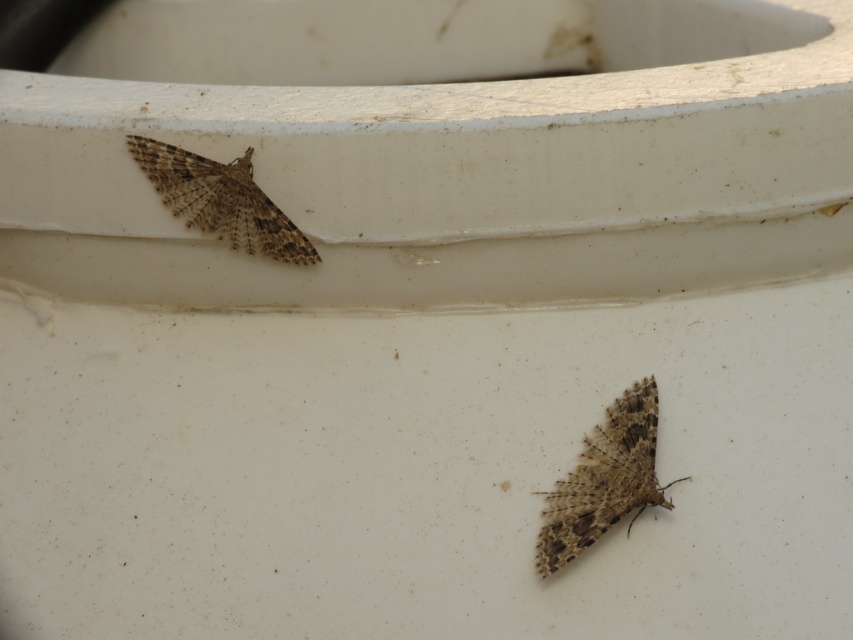
Is brown textured moth at lower center closer to camera compared to brown textured moth at upper left?

Yes, it is in front of brown textured moth at upper left.

This screenshot has width=853, height=640. Describe the element at coordinates (604, 480) in the screenshot. I see `brown textured moth at lower center` at that location.

At what (x,y) coordinates should I click in order to perform the action: click on brown textured moth at lower center. Please return your answer as a coordinate pair (x, y). The image size is (853, 640). Looking at the image, I should click on (604, 480).